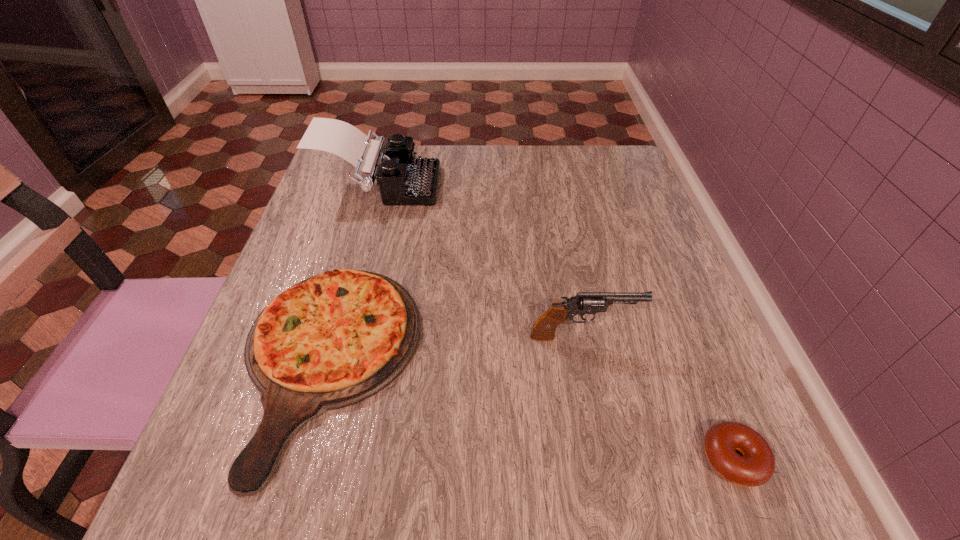
This screenshot has width=960, height=540. Identify the location of the tallest object. (403, 179).

Image resolution: width=960 pixels, height=540 pixels. What are the coordinates of `the farthest object` in the screenshot? It's located at (403, 179).

Where is `gun`? gun is located at coordinates (544, 328).

You are a GUI agent. You are given a task and a screenshot of the screen. Output one action in this format:
    pyautogui.click(x=<x>, y=<y>)
    Task: Click on the second object from right to left
    The height and width of the screenshot is (540, 960).
    Given the screenshot: What is the action you would take?
    pyautogui.click(x=544, y=328)

Identify the location of pizza. This screenshot has height=540, width=960. (333, 340).

This screenshot has width=960, height=540. In order to click on doughnut in this screenshot , I will do `click(756, 466)`.

You are a GUI agent. You are given a task and a screenshot of the screen. Output one action in this format:
    pyautogui.click(x=<x>, y=<y>)
    Task: Click on the rightmost object
    
    Given the screenshot: What is the action you would take?
    pyautogui.click(x=756, y=466)

What are the coordinates of `vacant position located on the keys of the tallest object` in the screenshot? It's located at (540, 187).

Find the location of a particular element. Image resolution: width=960 pixels, height=540 pixels. vacant region located along the barrel of the second object from right to left is located at coordinates click(x=664, y=336).

In order to click on vacant space situated 0.200m on the right of the third tallest object in this screenshot , I will do `click(538, 364)`.